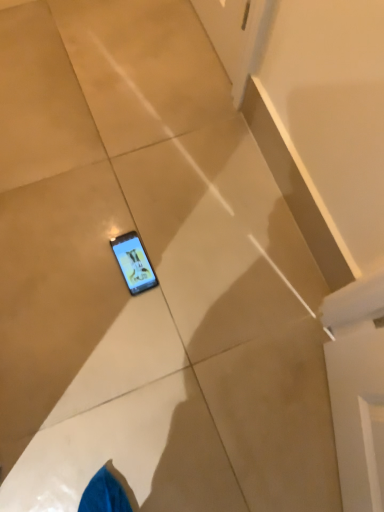
Question: Should I look upward or downward to see shiny black phone at center?

Choices:
 (A) up
 (B) down

Answer: (B)